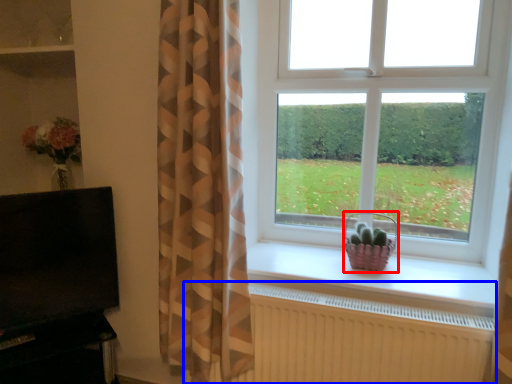
Question: Which object is closer to the camera taking this photo, basket (highlighted by a red box) or radiator (highlighted by a blue box)?

Choices:
 (A) basket
 (B) radiator

Answer: (B)